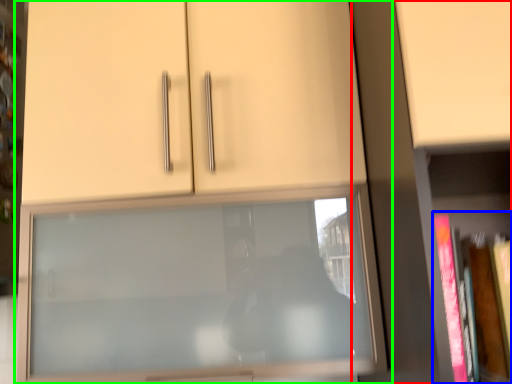
Question: Based on their relative distances, which object is nearer to bookcase (highlighted by a red box)? Choose from book (highlighted by a blue box) and cupboard (highlighted by a green box).

Choices:
 (A) book
 (B) cupboard

Answer: (A)